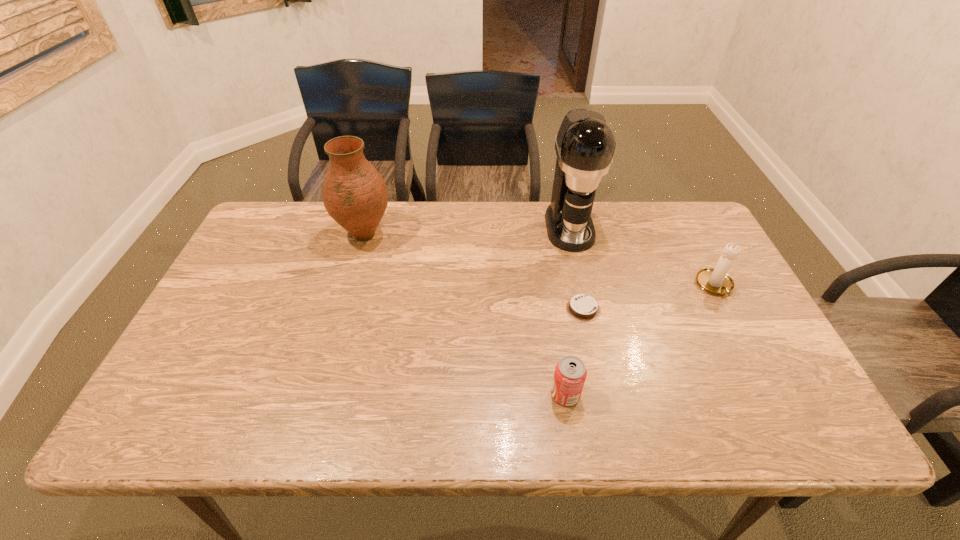
The width and height of the screenshot is (960, 540). In the image, there is a desktop. In order to click on free space at the right edge in this screenshot , I will do `click(717, 312)`.

Locate an element on the screen. Image resolution: width=960 pixels, height=540 pixels. vacant space at the far left corner of the desktop is located at coordinates (304, 210).

You are a GUI agent. You are given a task and a screenshot of the screen. Output one action in this format:
    pyautogui.click(x=<x>, y=<y>)
    Task: Click on the free area in between the third shortest object and the second shortest object
    
    Given the screenshot: What is the action you would take?
    pyautogui.click(x=640, y=340)

Locate an element on the screen. The image size is (960, 540). empty space between the third shortest object and the vase is located at coordinates (540, 261).

This screenshot has height=540, width=960. Identify the location of vacant space that is in between the chocolate cake and the leftmost object. (474, 272).

You are a GUI agent. You are given a task and a screenshot of the screen. Output one action in this format:
    pyautogui.click(x=<x>, y=<y>)
    Task: Click on the free space that is in between the shortest object and the rightmost object
    
    Given the screenshot: What is the action you would take?
    pyautogui.click(x=649, y=298)

Identify the location of blank region between the tallest object and the chocolate cake. Image resolution: width=960 pixels, height=540 pixels. (576, 268).

You are a GUI agent. You are given a task and a screenshot of the screen. Output one action in this format:
    pyautogui.click(x=<x>, y=<y>)
    Task: Click on the empty location between the coffee maker and the vase
    
    Given the screenshot: What is the action you would take?
    pyautogui.click(x=468, y=231)

You are a GUI agent. You are given a task and a screenshot of the screen. Output one action in this format:
    pyautogui.click(x=<x>, y=<y>)
    Task: Click on the free space between the chocolate cake and the fourth shortest object
    This screenshot has width=960, height=540.
    Given the screenshot: What is the action you would take?
    pyautogui.click(x=474, y=272)

At what (x,y) coordinates should I click in order to perform the action: click on vacant space that is in between the fourth shortest object and the coffee maker. Please return your answer as a coordinate pair (x, y). The image size is (960, 540). Looking at the image, I should click on (468, 231).